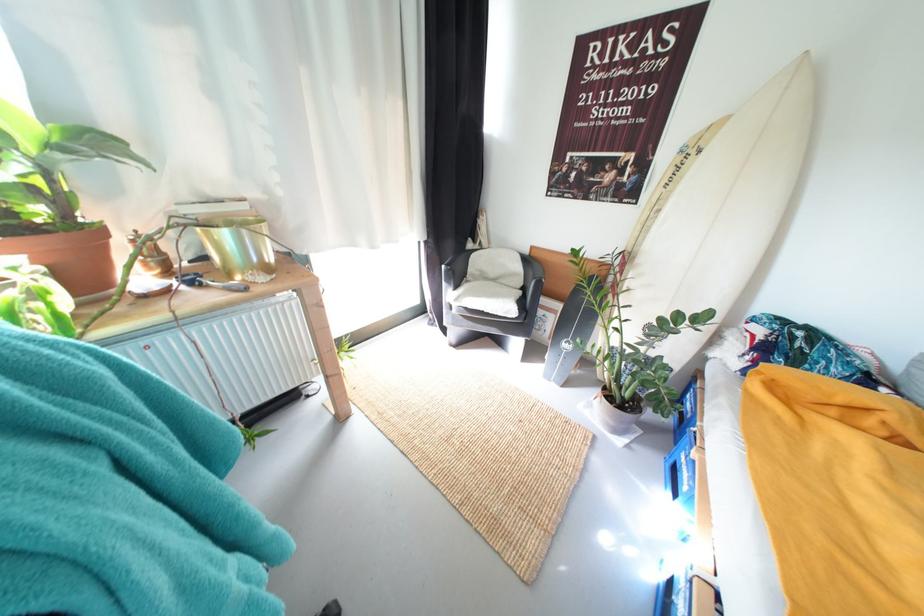
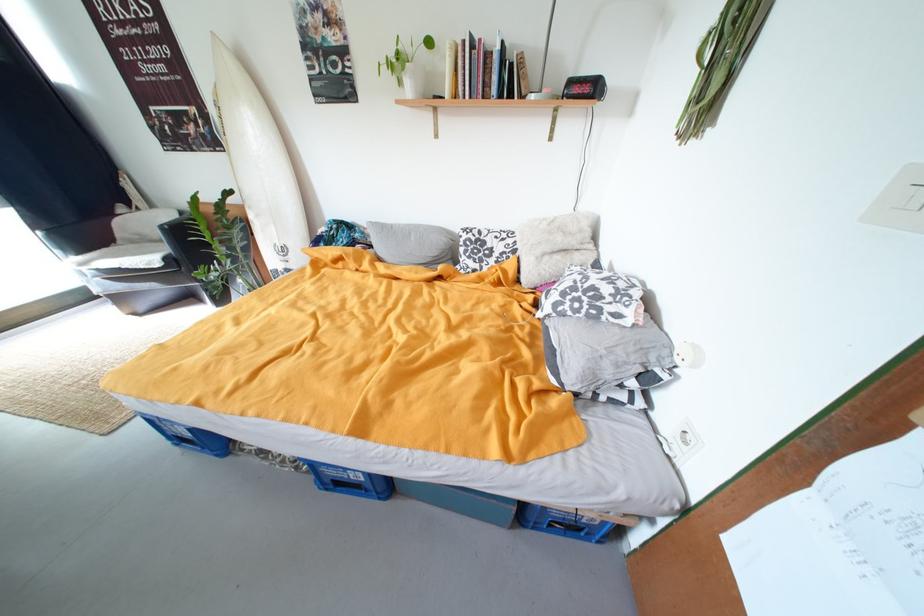
The point at (503, 282) is marked in the first image. Where is the corresponding point in the second image?

(169, 243)